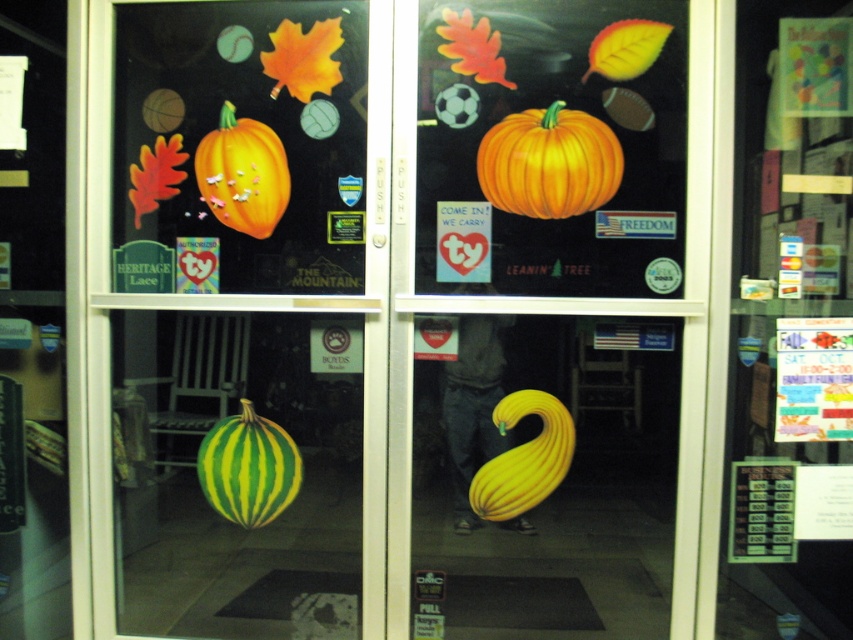
Question: Which point is farther to the camera?

Choices:
 (A) orange matte pumpkin at upper center
 (B) orange matte pumpkin at center
 (C) matte orange pumpkin at upper left
 (D) yellow matte squash at center

Answer: (D)

Question: Which point is farther from the camera taking this photo?

Choices:
 (A) (229, 472)
 (B) (425, 13)
 (C) (561, 408)

Answer: (A)

Question: Can you confirm if green striped pumpkin at lower left is bigger than matte orange pumpkin at upper left?

Choices:
 (A) no
 (B) yes

Answer: (B)

Question: Which point appears closest to the camera in this image?

Choices:
 (A) (256, 172)
 (B) (599, 307)
 (C) (556, 444)
 (D) (599, 573)

Answer: (B)

Question: Does matte orange pumpkin at upper left have a smaller size compared to yellow matte squash at center?

Choices:
 (A) no
 (B) yes

Answer: (B)

Question: Does orange matte pumpkin at upper center have a greater width compared to matte orange pumpkin at upper left?

Choices:
 (A) yes
 (B) no

Answer: (A)